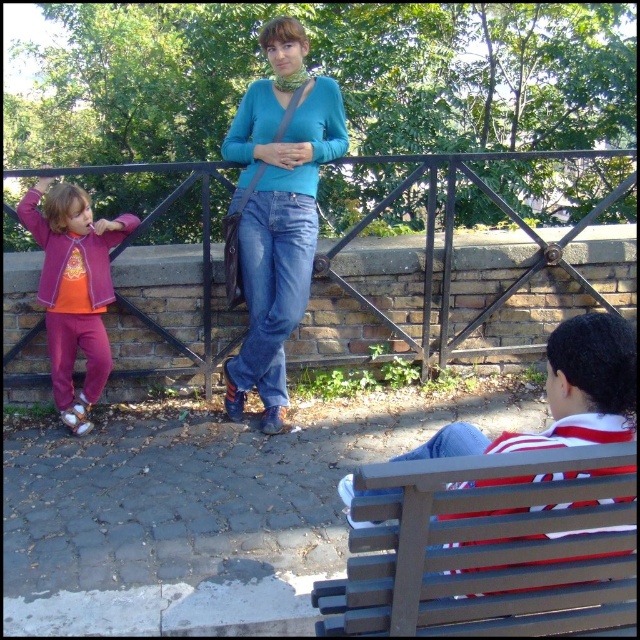
Question: Does striped cotton shirt at lower right have a lesser width compared to purple fleece jacket at left?

Choices:
 (A) yes
 (B) no

Answer: (B)

Question: Based on their relative distances, which object is farther from the striped cotton shirt at lower right?

Choices:
 (A) purple fleece jacket at left
 (B) brown wooden bench at lower right
 (C) blue denim jeans at center

Answer: (A)

Question: Is brown wooden bench at lower right smaller than striped cotton shirt at lower right?

Choices:
 (A) no
 (B) yes

Answer: (B)

Question: Which point is farther to the camera?

Choices:
 (A) blue denim jeans at center
 (B) matte blue sweater at center
 (C) brown wooden bench at lower right

Answer: (B)

Question: Which object appears closest to the camera in this image?

Choices:
 (A) blue denim jeans at center
 (B) matte blue sweater at center
 (C) brown wooden bench at lower right
 (D) purple fleece jacket at left

Answer: (C)

Question: Where is brown wooden bench at lower right located in relation to blue denim jeans at center in the image?

Choices:
 (A) above
 (B) below

Answer: (B)